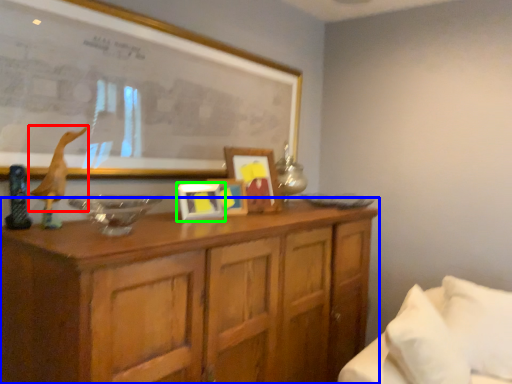
Question: Based on their relative distances, which object is nearer to animal (highlighted by a red box)? Choose from cabinetry (highlighted by a blue box) and picture frame (highlighted by a green box).

Choices:
 (A) cabinetry
 (B) picture frame

Answer: (B)